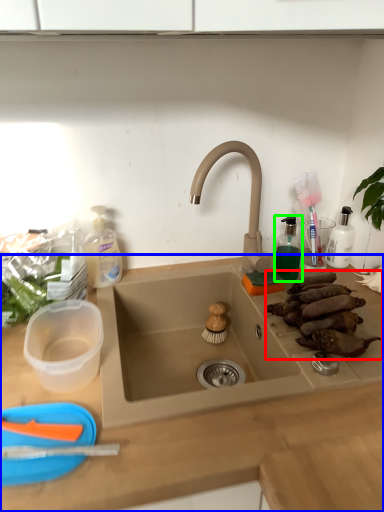
Question: Considering the real-world distances, which object is closest to food (highlighted by a red box)? countertop (highlighted by a blue box) or toiletry (highlighted by a green box).

Choices:
 (A) countertop
 (B) toiletry

Answer: (B)